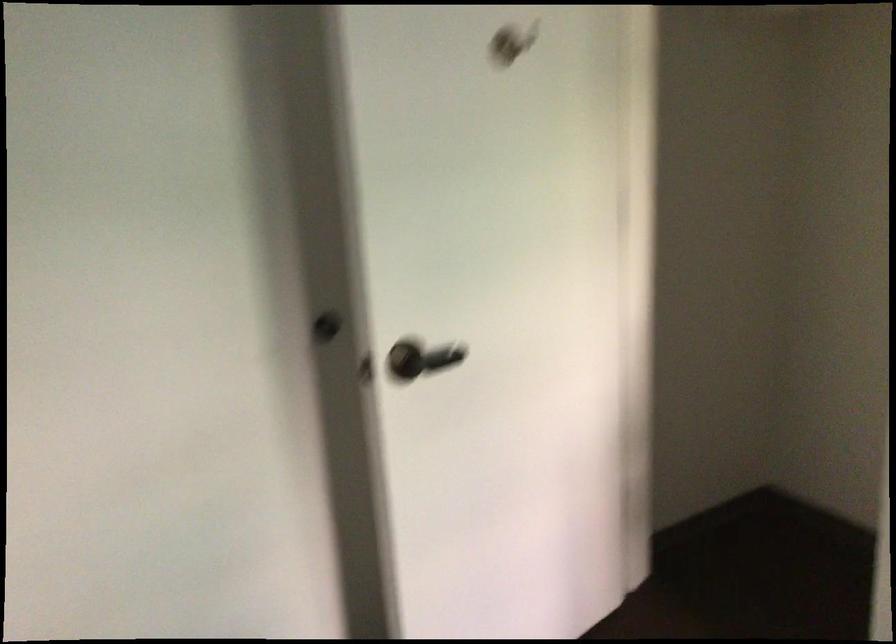
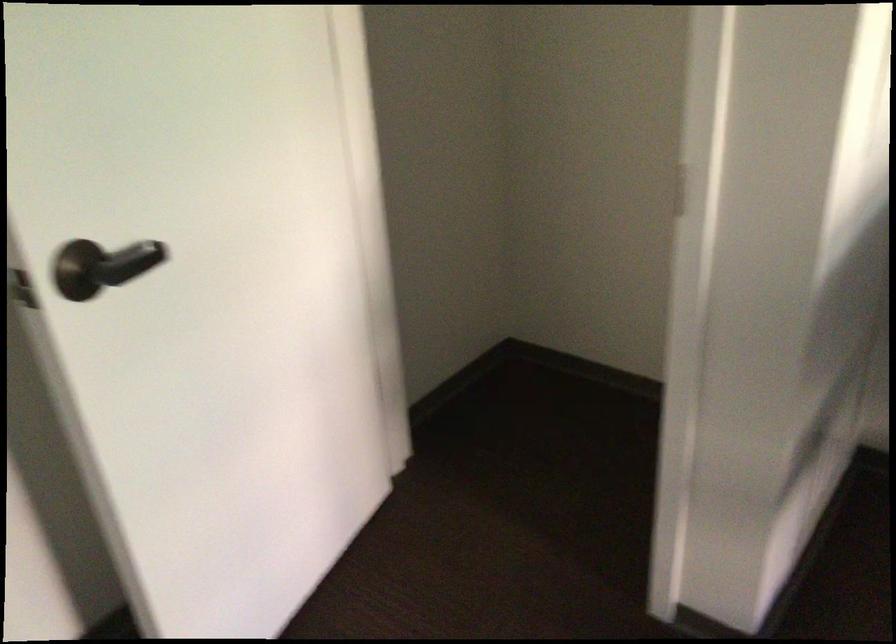
In the second image, find the point that corresponds to point (420, 357) in the first image.

(107, 265)